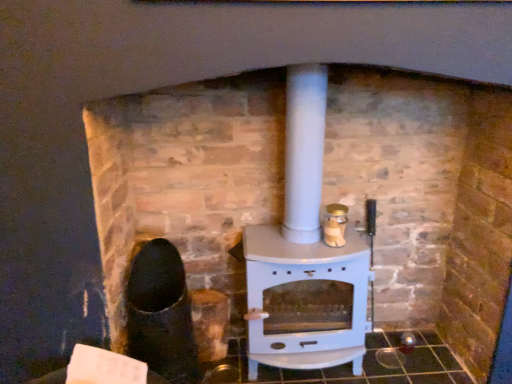
This screenshot has height=384, width=512. What do you see at coordinates (335, 225) in the screenshot? I see `gold metallic jar at center-right` at bounding box center [335, 225].

The width and height of the screenshot is (512, 384). What are the coordinates of `gold metallic jar at center-right` in the screenshot? It's located at (335, 225).

Locate an element on the screen. The image size is (512, 384). white glossy wood burning stove at center is located at coordinates (304, 245).

This screenshot has width=512, height=384. Describe the element at coordinates (304, 245) in the screenshot. I see `white glossy wood burning stove at center` at that location.

The width and height of the screenshot is (512, 384). I want to click on gold metallic jar at center-right, so click(335, 225).

Based on their positions, is white glossy wood burning stove at center located to the left or right of gold metallic jar at center-right?

In the image, white glossy wood burning stove at center appears on the left side of gold metallic jar at center-right.

Which object is closer to the camera, white glossy wood burning stove at center or gold metallic jar at center-right?

white glossy wood burning stove at center is closer to the camera.

Between point (309, 331) and point (326, 241), which one is positioned in front?

Point (326, 241)

From the image's perspective, does white glossy wood burning stove at center appear higher than gold metallic jar at center-right?

No.

From a real-world perspective, is white glossy wood burning stove at center on gold metallic jar at center-right?

No, from a real-world perspective, white glossy wood burning stove at center is not above gold metallic jar at center-right.

Which of these two, white glossy wood burning stove at center or gold metallic jar at center-right, is thinner?

With smaller width is gold metallic jar at center-right.

Is white glossy wood burning stove at center shorter than gold metallic jar at center-right?

No, white glossy wood burning stove at center is not shorter than gold metallic jar at center-right.

Considering the sizes of objects white glossy wood burning stove at center and gold metallic jar at center-right in the image provided, who is bigger, white glossy wood burning stove at center or gold metallic jar at center-right?

Bigger between the two is white glossy wood burning stove at center.

Would you say white glossy wood burning stove at center is outside gold metallic jar at center-right?

white glossy wood burning stove at center is positioned outside gold metallic jar at center-right.

Does white glossy wood burning stove at center touch gold metallic jar at center-right?

No.

Is white glossy wood burning stove at center facing towards gold metallic jar at center-right?

Yes, white glossy wood burning stove at center is aimed at gold metallic jar at center-right.

How many degrees apart are the facing directions of white glossy wood burning stove at center and gold metallic jar at center-right?

white glossy wood burning stove at center and gold metallic jar at center-right are facing 5.22 degrees away from each other.

From the picture: How much distance is there between white glossy wood burning stove at center and gold metallic jar at center-right?

A distance of 8.48 inches exists between white glossy wood burning stove at center and gold metallic jar at center-right.

What are the coordinates of `appliance above the white glossy wood burning stove at center (from a real-world perspective)` in the screenshot? It's located at (335, 225).

In the image, is gold metallic jar at center-right on the left side or the right side of white glossy wood burning stove at center?

Based on their positions, gold metallic jar at center-right is located to the right of white glossy wood burning stove at center.

Considering their positions, is gold metallic jar at center-right located in front of or behind white glossy wood burning stove at center?

Clearly, gold metallic jar at center-right is behind white glossy wood burning stove at center.

Does point (326, 212) appear closer or farther from the camera than point (311, 203)?

Point (326, 212).

From the image's perspective, which is above, gold metallic jar at center-right or white glossy wood burning stove at center?

gold metallic jar at center-right, from the image's perspective.

From a real-world perspective, is gold metallic jar at center-right located higher than white glossy wood burning stove at center?

Yes, from a real-world perspective, gold metallic jar at center-right is on top of white glossy wood burning stove at center.

Does gold metallic jar at center-right have a greater width compared to white glossy wood burning stove at center?

In fact, gold metallic jar at center-right might be narrower than white glossy wood burning stove at center.

In terms of height, does gold metallic jar at center-right look taller or shorter compared to white glossy wood burning stove at center?

Clearly, gold metallic jar at center-right is shorter compared to white glossy wood burning stove at center.

Considering the sizes of gold metallic jar at center-right and white glossy wood burning stove at center in the image, is gold metallic jar at center-right bigger or smaller than white glossy wood burning stove at center?

gold metallic jar at center-right is smaller than white glossy wood burning stove at center.

Is gold metallic jar at center-right located outside white glossy wood burning stove at center?

No, gold metallic jar at center-right is inside or overlapping with white glossy wood burning stove at center.

Is gold metallic jar at center-right positioned far away from white glossy wood burning stove at center?

Actually, gold metallic jar at center-right and white glossy wood burning stove at center are a little close together.

Is gold metallic jar at center-right facing away from white glossy wood burning stove at center?

Correct, gold metallic jar at center-right is looking away from white glossy wood burning stove at center.

What's the angular difference between gold metallic jar at center-right and white glossy wood burning stove at center's facing directions?

The angle between the facing direction of gold metallic jar at center-right and the facing direction of white glossy wood burning stove at center is 5.22 degrees.

The image size is (512, 384). I want to click on appliance on the right of white glossy wood burning stove at center, so click(335, 225).

Where is `appliance above the white glossy wood burning stove at center (from the image's perspective)`? Image resolution: width=512 pixels, height=384 pixels. appliance above the white glossy wood burning stove at center (from the image's perspective) is located at coordinates (335, 225).

Locate an element on the screen. This screenshot has height=384, width=512. appliance behind the white glossy wood burning stove at center is located at coordinates (335, 225).